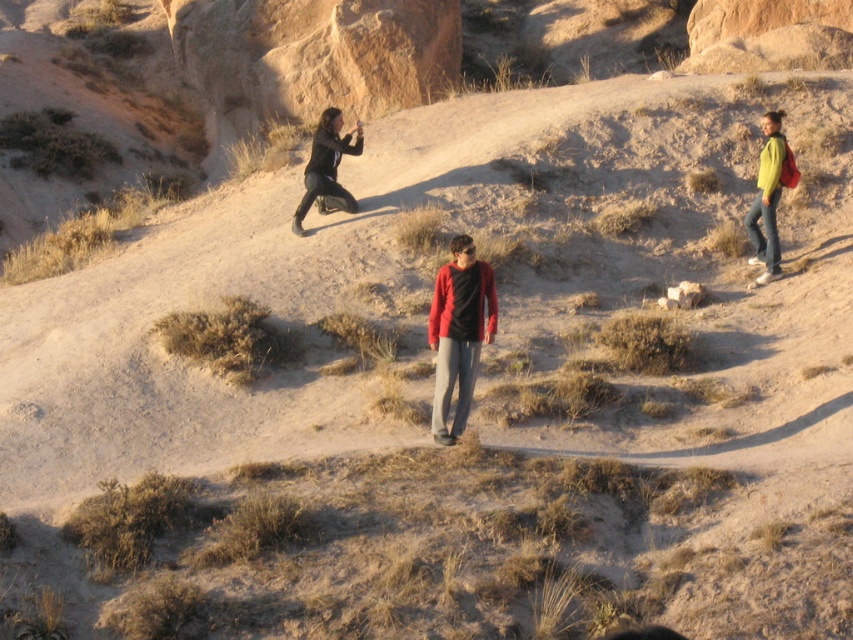
You are planning to take a photo of the two people wearing the matte red sweater at center and the matte black jacket at upper center. Which one should you focus on first if you want to capture both in the same frame without moving the camera?

You should focus on the matte red sweater at center first because it is much taller than the matte black jacket at upper center, so it will be easier to include both in the frame by centering on the taller one.

You are planning to take a photo of the two people in the desert scene. The matte red sweater at center and the green matte jacket at right are both in your viewfinder. Based on their positions, which one should you focus on first if you want to capture both clearly in the same frame?

The matte red sweater at center is below the green matte jacket at right, so focusing on the green matte jacket at right first would ensure both are in the frame as the sweater is positioned lower.

You are planning to take a photo of the two jackets in the scene. The matte black jacket at upper center and the green matte jacket at right. Which jacket should you focus on first if you want to capture both in a single frame without moving the camera?

You should focus on the matte black jacket at upper center first because it is shorter than the green matte jacket at right, so you can position it lower in the frame while still including the taller green jacket in the background.